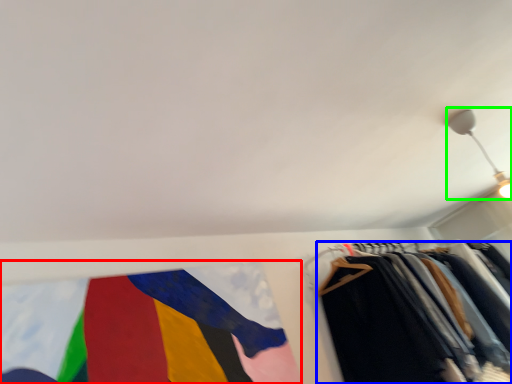
Question: Which object is positioned closest to flag (highlighted by a red box)? Select from trousers (highlighted by a blue box) and light fixture (highlighted by a green box).

Choices:
 (A) trousers
 (B) light fixture

Answer: (A)